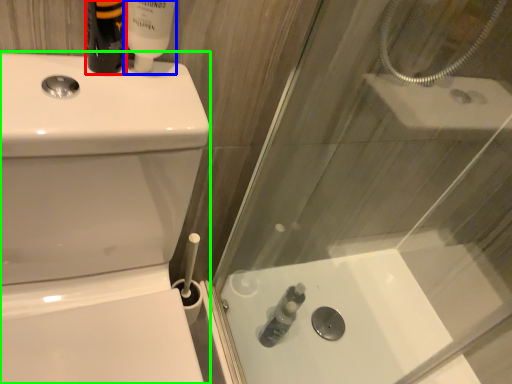
Question: Considering the real-world distances, which object is closest to toiletry (highlighted by a red box)? toiletry (highlighted by a blue box) or toilet bowl (highlighted by a green box).

Choices:
 (A) toiletry
 (B) toilet bowl

Answer: (A)